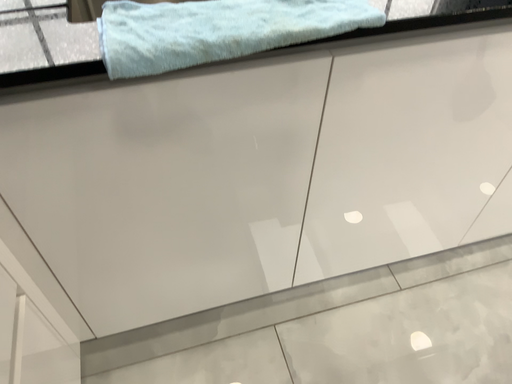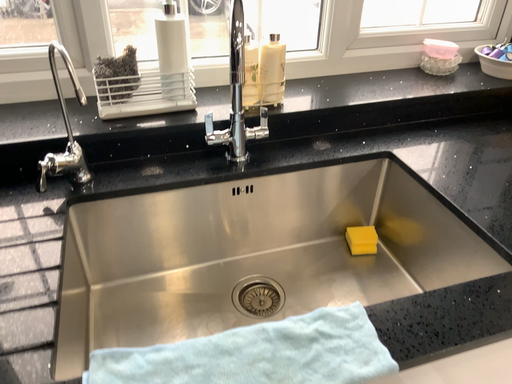
Question: Which way did the camera rotate in the video?

Choices:
 (A) rotated downward
 (B) rotated upward

Answer: (B)